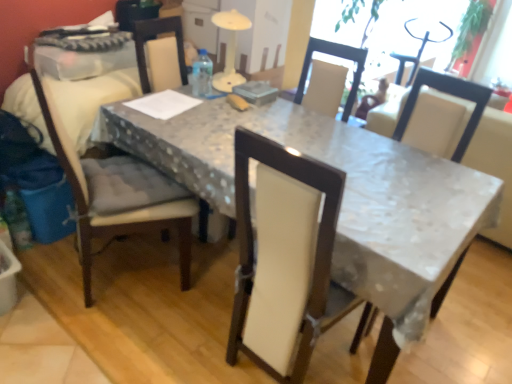
Find the location of a particular element. This screenshot has width=512, height=384. matte beige cushioned chair at left, the 2th chair when ordered from right to left is located at coordinates (117, 194).

The image size is (512, 384). Identify the location of white glossy table at center. (343, 200).

The height and width of the screenshot is (384, 512). Find the location of `green leafy plant at upper right`. green leafy plant at upper right is located at coordinates (471, 28).

In terms of height, does matte beige cushioned chair at left, the 2th chair when ordered from right to left, look taller or shorter compared to white fabric chair at center, the 2th chair when ordered from left to right?

Considering their sizes, matte beige cushioned chair at left, the 2th chair when ordered from right to left, has more height than white fabric chair at center, the 2th chair when ordered from left to right.

Is matte beige cushioned chair at left, which is the first chair from left to right, not inside white fabric chair at center, positioned as the 1th chair in right-to-left order?

matte beige cushioned chair at left, which is the first chair from left to right, lies outside white fabric chair at center, positioned as the 1th chair in right-to-left order,'s area.

Does matte beige cushioned chair at left, which is the first chair from left to right, turn towards white fabric chair at center, positioned as the 1th chair in right-to-left order?

Yes, matte beige cushioned chair at left, which is the first chair from left to right, faces towards white fabric chair at center, positioned as the 1th chair in right-to-left order.

Considering the sizes of objects matte beige cushioned chair at left, the 2th chair when ordered from right to left, and white fabric chair at center, positioned as the 1th chair in right-to-left order, in the image provided, who is smaller, matte beige cushioned chair at left, the 2th chair when ordered from right to left, or white fabric chair at center, positioned as the 1th chair in right-to-left order,?

white fabric chair at center, positioned as the 1th chair in right-to-left order, is smaller.

How many degrees apart are the facing directions of white fabric chair at center, the 2th chair when ordered from left to right, and white glossy table at center?

They differ by 95.1 degrees in their facing directions.

Is white glossy table at center at the back of white fabric chair at center, positioned as the 1th chair in right-to-left order?

Yes, white fabric chair at center, positioned as the 1th chair in right-to-left order, is facing away from white glossy table at center.

Does white fabric chair at center, positioned as the 1th chair in right-to-left order, touch white glossy table at center?

No, white fabric chair at center, positioned as the 1th chair in right-to-left order, is not with white glossy table at center.

In terms of width, does white fabric chair at center, positioned as the 1th chair in right-to-left order, look wider or thinner when compared to white glossy table at center?

In the image, white fabric chair at center, positioned as the 1th chair in right-to-left order, appears to be more narrow than white glossy table at center.

Visually, is white glossy table at center positioned to the left or to the right of matte beige cushioned chair at left, which is the first chair from left to right?

From the image, it's evident that white glossy table at center is to the right of matte beige cushioned chair at left, which is the first chair from left to right.

Based on their sizes in the image, would you say white glossy table at center is bigger or smaller than matte beige cushioned chair at left, which is the first chair from left to right?

Clearly, white glossy table at center is larger in size than matte beige cushioned chair at left, which is the first chair from left to right.

Between white glossy table at center and matte beige cushioned chair at left, which is the first chair from left to right, which one has less height?

Standing shorter between the two is white glossy table at center.

Considering the relative sizes of white glossy table at center and matte beige cushioned chair at left, which is the first chair from left to right, in the image provided, is white glossy table at center thinner than matte beige cushioned chair at left, which is the first chair from left to right,?

No.

From the image's perspective, does white fabric chair at center, positioned as the 1th chair in right-to-left order, appear higher than green leafy plant at upper right?

No, from the image's perspective, white fabric chair at center, positioned as the 1th chair in right-to-left order, is not on top of green leafy plant at upper right.

Is there a large distance between white fabric chair at center, positioned as the 1th chair in right-to-left order, and green leafy plant at upper right?

Yes, white fabric chair at center, positioned as the 1th chair in right-to-left order, and green leafy plant at upper right are located far from each other.

Considering the sizes of objects white fabric chair at center, the 2th chair when ordered from left to right, and green leafy plant at upper right in the image provided, who is bigger, white fabric chair at center, the 2th chair when ordered from left to right, or green leafy plant at upper right?

With larger size is white fabric chair at center, the 2th chair when ordered from left to right.

Is white fabric chair at center, positioned as the 1th chair in right-to-left order, turned away from matte beige cushioned chair at left, the 2th chair when ordered from right to left?

No, white fabric chair at center, positioned as the 1th chair in right-to-left order, is not facing away from matte beige cushioned chair at left, the 2th chair when ordered from right to left.

Which is behind, point (473, 122) or point (170, 197)?

Positioned behind is point (473, 122).

Which of these two, white fabric chair at center, the 2th chair when ordered from left to right, or matte beige cushioned chair at left, the 2th chair when ordered from right to left, is smaller?

white fabric chair at center, the 2th chair when ordered from left to right.

Is white glossy table at center at the back of green leafy plant at upper right?

No, green leafy plant at upper right is not facing the opposite direction of white glossy table at center.

Is green leafy plant at upper right wider or thinner than white glossy table at center?

green leafy plant at upper right is thinner than white glossy table at center.

How many degrees apart are the facing directions of green leafy plant at upper right and white glossy table at center?

The angle between the facing direction of green leafy plant at upper right and the facing direction of white glossy table at center is 0.184 degrees.

Can you confirm if green leafy plant at upper right is bigger than white glossy table at center?

No, green leafy plant at upper right is not bigger than white glossy table at center.

Between matte beige cushioned chair at left, which is the first chair from left to right, and white glossy table at center, which one has larger width?

white glossy table at center.

Would you say matte beige cushioned chair at left, the 2th chair when ordered from right to left, is inside or outside white glossy table at center?

matte beige cushioned chair at left, the 2th chair when ordered from right to left, is inside white glossy table at center.

The width and height of the screenshot is (512, 384). I want to click on table that appears below the matte beige cushioned chair at left, which is the first chair from left to right (from a real-world perspective), so click(343, 200).

The width and height of the screenshot is (512, 384). I want to click on chair located above the white fabric chair at center, the 2th chair when ordered from left to right (from the image's perspective), so click(x=117, y=194).

What are the coordinates of `table below the white fabric chair at center, positioned as the 1th chair in right-to-left order (from a real-world perspective)` in the screenshot? It's located at (343, 200).

Based on their spatial positions, is green leafy plant at upper right or white glossy table at center further from matte beige cushioned chair at left, the 2th chair when ordered from right to left?

green leafy plant at upper right.

Which object lies nearer to the anchor point matte beige cushioned chair at left, the 2th chair when ordered from right to left, white glossy table at center or white fabric chair at center, positioned as the 1th chair in right-to-left order?

Among the two, white glossy table at center is located nearer to matte beige cushioned chair at left, the 2th chair when ordered from right to left.

Considering their positions, is matte beige cushioned chair at left, the 2th chair when ordered from right to left, positioned closer to white glossy table at center than white fabric chair at center, the 2th chair when ordered from left to right?

matte beige cushioned chair at left, the 2th chair when ordered from right to left, lies closer to white glossy table at center than the other object.

Considering their positions, is white glossy table at center positioned further to white fabric chair at center, positioned as the 1th chair in right-to-left order, than green leafy plant at upper right?

The object further to white fabric chair at center, positioned as the 1th chair in right-to-left order, is green leafy plant at upper right.

From the image, which object appears to be nearer to green leafy plant at upper right, white glossy table at center or matte beige cushioned chair at left, the 2th chair when ordered from right to left?

Among the two, white glossy table at center is located nearer to green leafy plant at upper right.

When comparing their distances from white fabric chair at center, positioned as the 1th chair in right-to-left order, does green leafy plant at upper right or matte beige cushioned chair at left, the 2th chair when ordered from right to left, seem closer?

matte beige cushioned chair at left, the 2th chair when ordered from right to left, is positioned closer to the anchor white fabric chair at center, positioned as the 1th chair in right-to-left order.

Which object lies further to the anchor point white fabric chair at center, the 2th chair when ordered from left to right, matte beige cushioned chair at left, which is the first chair from left to right, or white glossy table at center?

matte beige cushioned chair at left, which is the first chair from left to right.

When comparing their distances from white fabric chair at center, the 2th chair when ordered from left to right, does matte beige cushioned chair at left, the 2th chair when ordered from right to left, or green leafy plant at upper right seem further?

green leafy plant at upper right is further to white fabric chair at center, the 2th chair when ordered from left to right.

Where is `table situated between matte beige cushioned chair at left, the 2th chair when ordered from right to left, and white fabric chair at center, positioned as the 1th chair in right-to-left order, from left to right`? This screenshot has height=384, width=512. table situated between matte beige cushioned chair at left, the 2th chair when ordered from right to left, and white fabric chair at center, positioned as the 1th chair in right-to-left order, from left to right is located at coordinates point(343,200).

What are the coordinates of `chair between matte beige cushioned chair at left, which is the first chair from left to right, and green leafy plant at upper right in the front-back direction` in the screenshot? It's located at (447, 93).